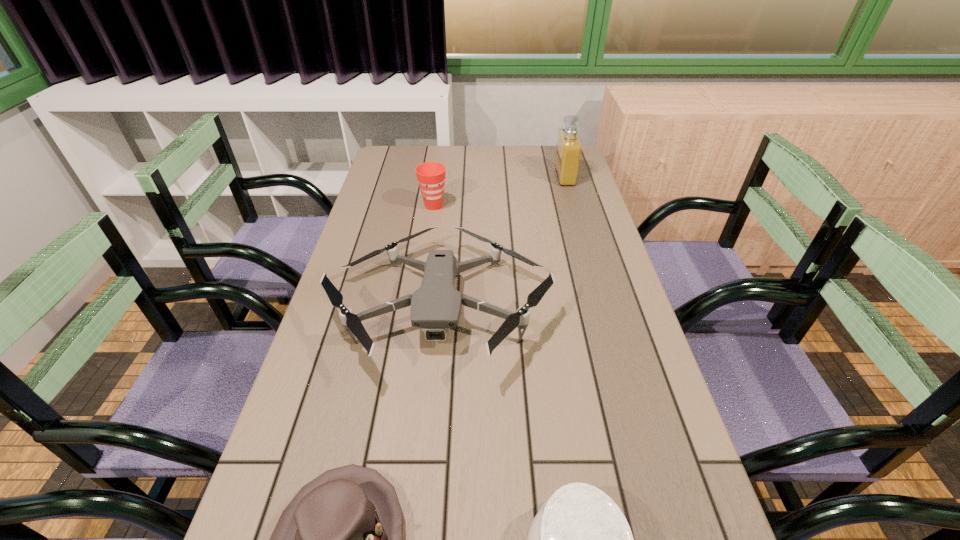
Locate an element on the screen. This screenshot has width=960, height=540. object situated at the far edge is located at coordinates (569, 148).

Locate an element on the screen. The image size is (960, 540). object at the left edge is located at coordinates (436, 306).

Where is `object positioned at the right edge`? The image size is (960, 540). object positioned at the right edge is located at coordinates (569, 148).

Where is `object that is at the far right corner`? object that is at the far right corner is located at coordinates (569, 148).

I want to click on vacant space at the far edge of the desktop, so click(492, 146).

At what (x,y) coordinates should I click in order to perform the action: click on blank space at the left edge. Please return your answer as a coordinate pair (x, y). The height and width of the screenshot is (540, 960). Looking at the image, I should click on (334, 333).

Where is `free spot at the right edge of the desktop`? The height and width of the screenshot is (540, 960). free spot at the right edge of the desktop is located at coordinates (607, 323).

Find the location of a particular element. Image resolution: width=960 pixels, height=540 pixels. free spot between the second farthest object and the rightmost object is located at coordinates (499, 191).

At what (x,y) coordinates should I click in order to perform the action: click on vacant space that's between the fourth nearest object and the farthest object. Please return your answer as a coordinate pair (x, y). This screenshot has height=540, width=960. Looking at the image, I should click on (499, 191).

You are a GUI agent. You are given a task and a screenshot of the screen. Output one action in this format:
    pyautogui.click(x=<x>, y=<y>)
    Task: Click on the closest object relative to the second farthest object
    The width and height of the screenshot is (960, 540).
    Given the screenshot: What is the action you would take?
    pyautogui.click(x=436, y=306)